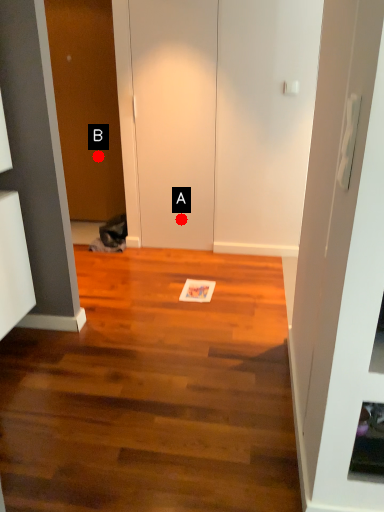
Question: Two points are circled on the image, labeled by A and B beside each circle. Which point is closer to the camera?

Choices:
 (A) A is closer
 (B) B is closer

Answer: (A)